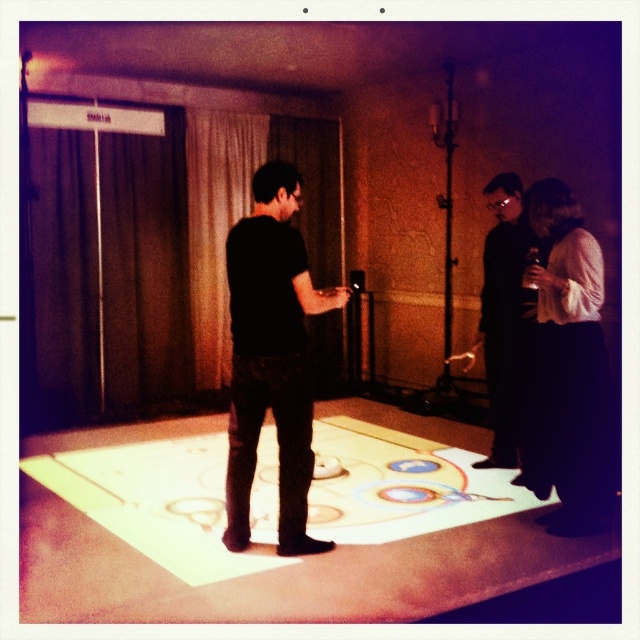
You are a fashion designer observing the scene. You need to decide which clothing item has a greater width between the black matte shirt at center and the black matte suit at right. Which one do you choose?

The black matte shirt at center has a greater width than the black matte suit at right according to the description.

You are a photographer positioned in front of the interactive game board. You need to take a photo that includes both the white matte dress at right and the black matte suit at right. Which one should you focus on to ensure both are in clear focus?

You should focus on the white matte dress at right because it is closer to the viewer than the black matte suit at right, so focusing on the closer object will keep both in focus.

You are a photographer positioned in the room and want to take a photo of both the black matte shirt at center and the white matte dress at right. Which one should you focus on first to ensure both are in the frame?

The black matte shirt at center is in front of the white matte dress at right, so focus on the black matte shirt at center first to ensure both are in the frame.